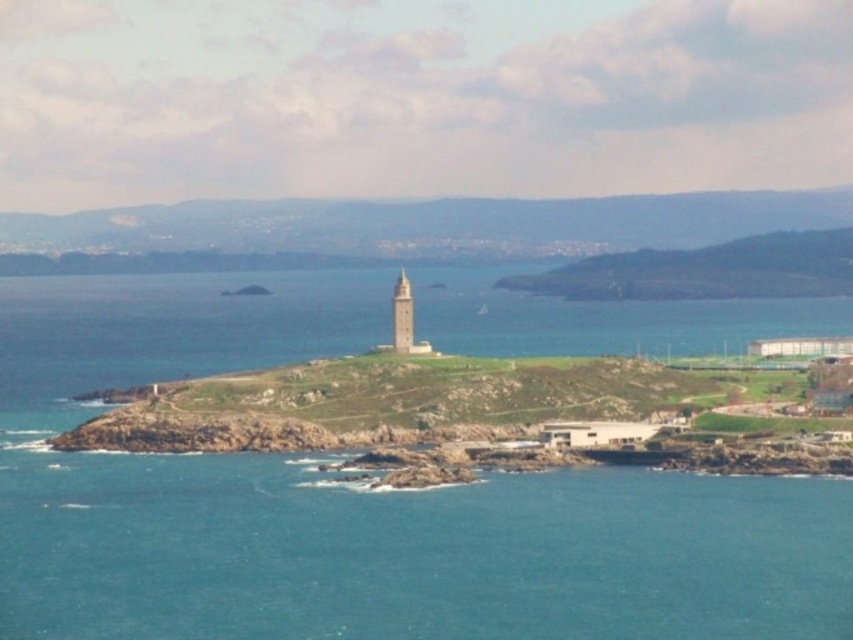
Identify the location of blue water at center. The width and height of the screenshot is (853, 640). (357, 502).

Between point (222, 550) and point (403, 324), which one is positioned in front?

Point (403, 324) is more forward.

Image resolution: width=853 pixels, height=640 pixels. What do you see at coordinates (357, 502) in the screenshot? I see `blue water at center` at bounding box center [357, 502].

At what (x,y) coordinates should I click in order to perform the action: click on blue water at center. Please return your answer as a coordinate pair (x, y). Image resolution: width=853 pixels, height=640 pixels. Looking at the image, I should click on (357, 502).